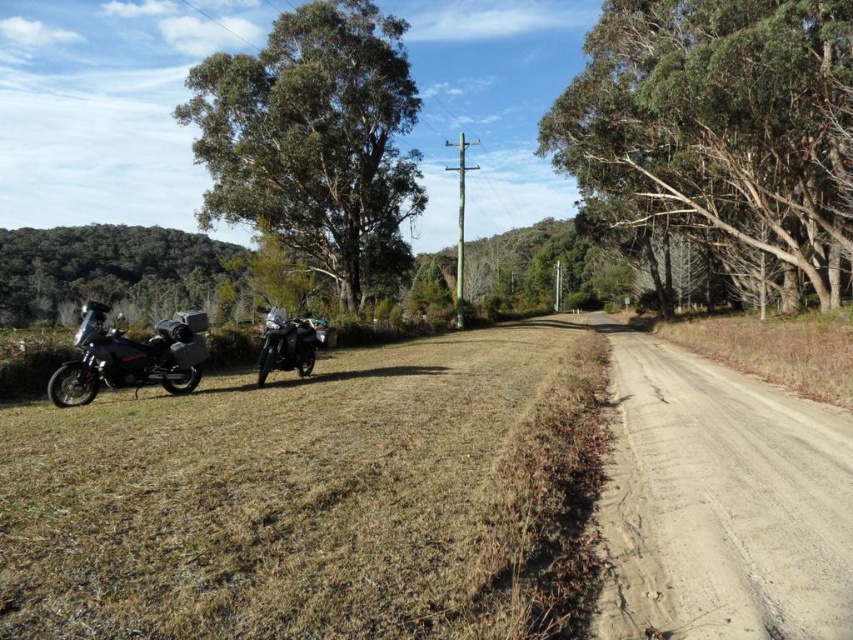
Between point (604, 589) and point (165, 378), which one is positioned behind?

Positioned behind is point (165, 378).

The width and height of the screenshot is (853, 640). What do you see at coordinates (720, 502) in the screenshot?
I see `dusty gravel road at right` at bounding box center [720, 502].

Where is `dusty gravel road at right`? dusty gravel road at right is located at coordinates (720, 502).

Who is more forward, [838,204] or [90,394]?

Point [90,394] is more forward.

Between green rough bark tree at upper right and matte black motorcycle at left, which one is positioned higher?

green rough bark tree at upper right is above.

Describe the element at coordinates (717, 124) in the screenshot. Image resolution: width=853 pixels, height=640 pixels. I see `green rough bark tree at upper right` at that location.

You are a GUI agent. You are given a task and a screenshot of the screen. Output one action in this format:
    pyautogui.click(x=<x>, y=<y>)
    Task: Click on the green rough bark tree at upper right
    
    Given the screenshot: What is the action you would take?
    pyautogui.click(x=717, y=124)

Does green rough bark tree at upper right have a smaller size compared to shiny metallic motorcycle at center?

Incorrect, green rough bark tree at upper right is not smaller in size than shiny metallic motorcycle at center.

Is point (816, 19) closer to camera compared to point (256, 380)?

No.

I want to click on green rough bark tree at upper right, so click(717, 124).